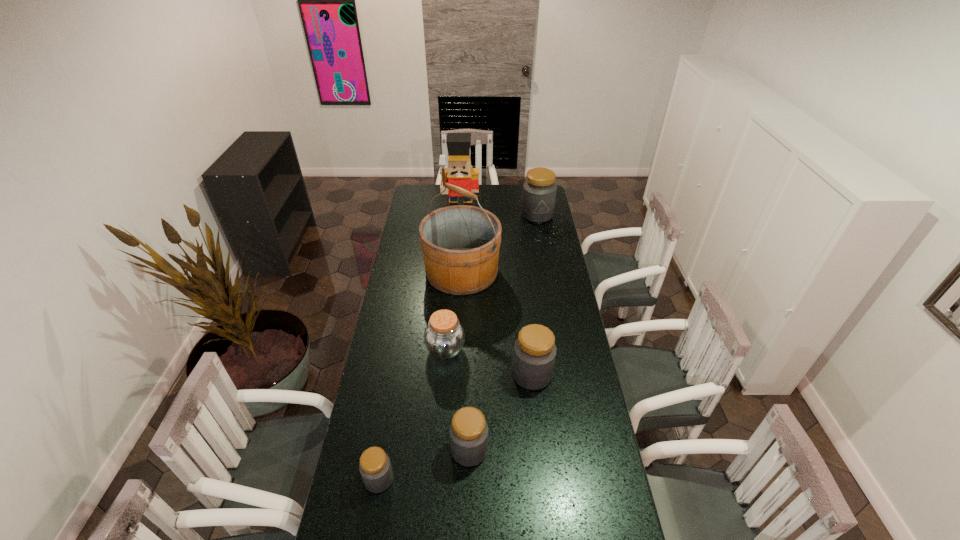
You are a GUI agent. You are given a task and a screenshot of the screen. Output one action in this format:
    pyautogui.click(x=<x>, y=<y>)
    Task: Click on the free space located in front of the red nutcracker holding the staff
    
    Given the screenshot: What is the action you would take?
    pyautogui.click(x=459, y=249)

Find the location of a particular element. free space located on the back of the third farthest object is located at coordinates (464, 239).

This screenshot has width=960, height=540. Identify the location of vacant space situated 0.060m on the surface of the biggest gray jar near the warning symbol. (540, 230).

Locate an element on the screen. This screenshot has height=540, width=960. vacant area situated 0.310m on the surface of the third nearest gray jar near the warning symbol is located at coordinates (432, 375).

Find the location of a particular element. blank space located on the surface of the third nearest gray jar near the warning symbol is located at coordinates (492, 375).

The width and height of the screenshot is (960, 540). What are the coordinates of `vacant space located on the surface of the third nearest gray jar near the warning symbol` in the screenshot? It's located at (412, 375).

The width and height of the screenshot is (960, 540). In order to click on vacant space located on the front of the brown jar in this screenshot , I will do `click(438, 455)`.

This screenshot has width=960, height=540. I want to click on free space located 0.310m on the surface of the second gray jar from left to right near the warning symbol, so click(x=580, y=450).

Locate an element on the screen. This screenshot has width=960, height=540. free spot located on the surface of the shortest object near the warning symbol is located at coordinates (431, 479).

Identify the location of bucket present at the left edge. (460, 244).